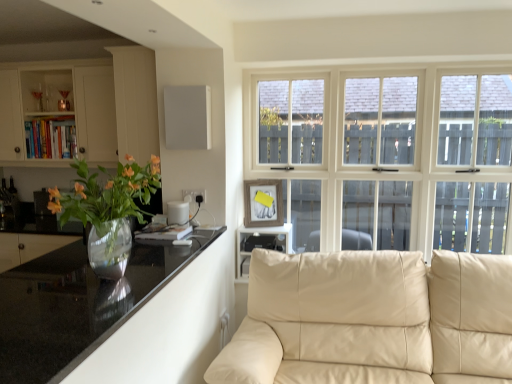
The height and width of the screenshot is (384, 512). Describe the element at coordinates (58, 113) in the screenshot. I see `matte white cabinet at left` at that location.

The image size is (512, 384). What do you see at coordinates (260, 244) in the screenshot? I see `black plastic shelf at center` at bounding box center [260, 244].

At what (x,y) coordinates should I click in order to perform the action: click on black glossy countertop at left. Please return your answer as a coordinate pair (x, y). Image resolution: width=512 pixels, height=384 pixels. Looking at the image, I should click on (77, 305).

The width and height of the screenshot is (512, 384). What do you see at coordinates (108, 210) in the screenshot?
I see `translucent glass vase at left` at bounding box center [108, 210].

Where is `matte white cabinet at left`? This screenshot has width=512, height=384. matte white cabinet at left is located at coordinates (58, 113).

From a real-world perspective, which is physically above, black glossy countertop at left or beige leather couch at lower right?

In real-world perspective, black glossy countertop at left is above.

Is there a large distance between black glossy countertop at left and beige leather couch at lower right?

They are positioned close to each other.

Considering the sizes of black glossy countertop at left and beige leather couch at lower right in the image, is black glossy countertop at left wider or thinner than beige leather couch at lower right?

Clearly, black glossy countertop at left has less width compared to beige leather couch at lower right.

Is black glossy countertop at left smaller than beige leather couch at lower right?

Indeed, black glossy countertop at left has a smaller size compared to beige leather couch at lower right.

Which of these two, beige leather couch at lower right or black glossy countertop at left, stands taller?

With more height is beige leather couch at lower right.

Is there a large distance between beige leather couch at lower right and black glossy countertop at left?

No, beige leather couch at lower right is not far from black glossy countertop at left.

Does beige leather couch at lower right have a lesser width compared to black glossy countertop at left?

No.

I want to click on countertop located in front of the beige leather couch at lower right, so click(77, 305).

Between black plastic shelf at center and translucent glass vase at left, which one has more height?

With more height is translucent glass vase at left.

Who is more distant, black plastic shelf at center or translucent glass vase at left?

black plastic shelf at center is further from the camera.

In the scene shown: Visually, is black plastic shelf at center positioned to the left or to the right of translucent glass vase at left?

Based on their positions, black plastic shelf at center is located to the right of translucent glass vase at left.

Between black glossy countertop at left and matte white cabinet at left, which one has larger width?

Wider between the two is black glossy countertop at left.

Is black glossy countertop at left facing away from matte white cabinet at left?

black glossy countertop at left does not have its back to matte white cabinet at left.

From a real-world perspective, does black glossy countertop at left stand above matte white cabinet at left?

No.

Based on the photo, how many degrees apart are the facing directions of black glossy countertop at left and matte white cabinet at left?

The angle between the facing direction of black glossy countertop at left and the facing direction of matte white cabinet at left is 90 degrees.

Which object is positioned more to the right, translucent glass vase at left or beige leather couch at lower right?

beige leather couch at lower right is more to the right.

Is point (109, 235) closer to viewer compared to point (432, 354)?

Yes, it is in front of point (432, 354).

Would you say translucent glass vase at left is outside beige leather couch at lower right?

Yes, translucent glass vase at left is outside of beige leather couch at lower right.

Considering the relative positions of translucent glass vase at left and matte white cabinet at left in the image provided, is translucent glass vase at left to the left or to the right of matte white cabinet at left?

translucent glass vase at left is positioned on matte white cabinet at left's right side.

I want to click on houseplant that appears below the matte white cabinet at left (from a real-world perspective), so click(108, 210).

From the image's perspective, is translucent glass vase at left above or below matte white cabinet at left?

Based on their image positions, translucent glass vase at left is located beneath matte white cabinet at left.

Looking at the image, does translucent glass vase at left seem bigger or smaller compared to matte white cabinet at left?

Considering their sizes, translucent glass vase at left takes up less space than matte white cabinet at left.

Looking at this image, can you confirm if black plastic shelf at center is shorter than beige leather couch at lower right?

Yes, black plastic shelf at center is shorter than beige leather couch at lower right.

Between point (284, 228) and point (253, 347), which one is positioned in front?

The point (253, 347) is more forward.

How many degrees apart are the facing directions of black plastic shelf at center and beige leather couch at lower right?

They differ by 0.89 degrees in their facing directions.

Between black plastic shelf at center and beige leather couch at lower right, which one is positioned behind?

black plastic shelf at center is behind.

Locate an element on the screen. The height and width of the screenshot is (384, 512). studio couch on the right of black glossy countertop at left is located at coordinates tap(373, 319).

I want to click on countertop on the left of beige leather couch at lower right, so click(x=77, y=305).

Considering their positions, is translucent glass vase at left positioned further to black plastic shelf at center than beige leather couch at lower right?

translucent glass vase at left lies further to black plastic shelf at center than the other object.

Estimate the real-world distances between objects in this image. Which object is closer to beige leather couch at lower right, translucent glass vase at left or black plastic shelf at center?

Among the two, black plastic shelf at center is located nearer to beige leather couch at lower right.

Estimate the real-world distances between objects in this image. Which object is closer to black glossy countertop at left, translucent glass vase at left or black plastic shelf at center?

Among the two, translucent glass vase at left is located nearer to black glossy countertop at left.

Based on their spatial positions, is beige leather couch at lower right or translucent glass vase at left closer to black glossy countertop at left?

translucent glass vase at left.

From the image, which object appears to be nearer to matte white cabinet at left, beige leather couch at lower right or black glossy countertop at left?

Based on the image, black glossy countertop at left appears to be nearer to matte white cabinet at left.

Considering their positions, is translucent glass vase at left positioned closer to matte white cabinet at left than black glossy countertop at left?

translucent glass vase at left lies closer to matte white cabinet at left than the other object.

From the image, which object appears to be farther from matte white cabinet at left, translucent glass vase at left or black plastic shelf at center?

translucent glass vase at left is further to matte white cabinet at left.

Considering their positions, is black plastic shelf at center positioned further to beige leather couch at lower right than black glossy countertop at left?

black glossy countertop at left is further to beige leather couch at lower right.

Find the location of a particular element. The height and width of the screenshot is (384, 512). houseplant between matte white cabinet at left and beige leather couch at lower right in the horizontal direction is located at coordinates (108, 210).

At what (x,y) coordinates should I click in order to perform the action: click on studio couch positioned between black glossy countertop at left and black plastic shelf at center from near to far. Please return your answer as a coordinate pair (x, y). This screenshot has height=384, width=512. Looking at the image, I should click on (373, 319).

Where is `shelf between matte white cabinet at left and beige leather couch at lower right in the horizontal direction`? shelf between matte white cabinet at left and beige leather couch at lower right in the horizontal direction is located at coordinates (260, 244).

You are a GUI agent. You are given a task and a screenshot of the screen. Output one action in this format:
    pyautogui.click(x=<x>, y=<y>)
    Task: Click on the houseplant between black glossy countertop at left and matte white cabinet at left along the z-axis
    This screenshot has width=512, height=384.
    Given the screenshot: What is the action you would take?
    pyautogui.click(x=108, y=210)